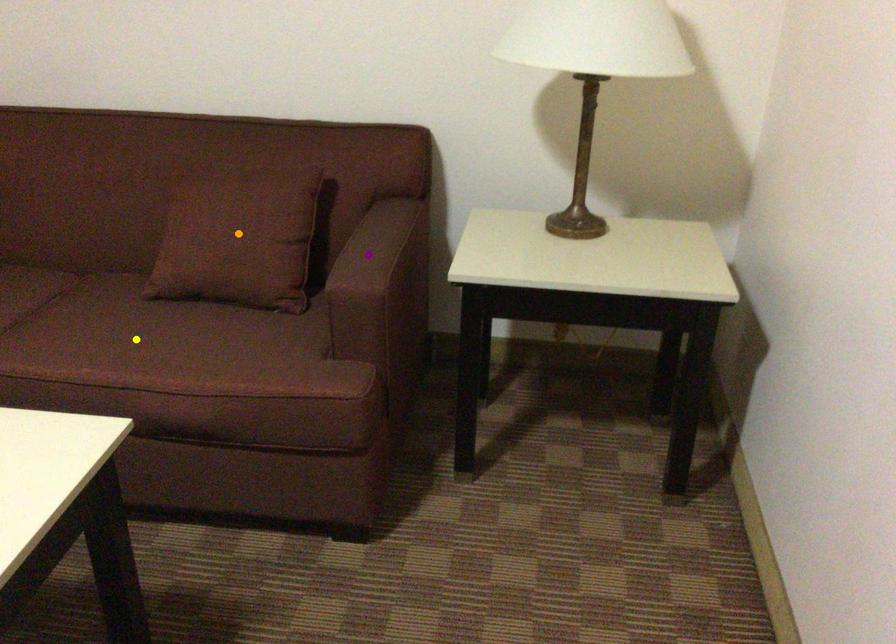
Order these from nearest to farthest:
orange point | yellow point | purple point

1. orange point
2. yellow point
3. purple point